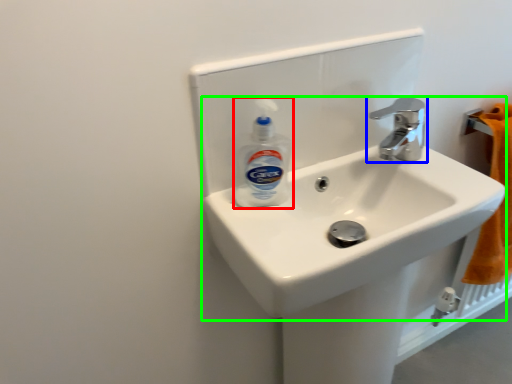
Question: Which is farther away from cleaning product (highlighted by a red box)? tap (highlighted by a blue box) or sink (highlighted by a green box)?

Choices:
 (A) tap
 (B) sink

Answer: (A)